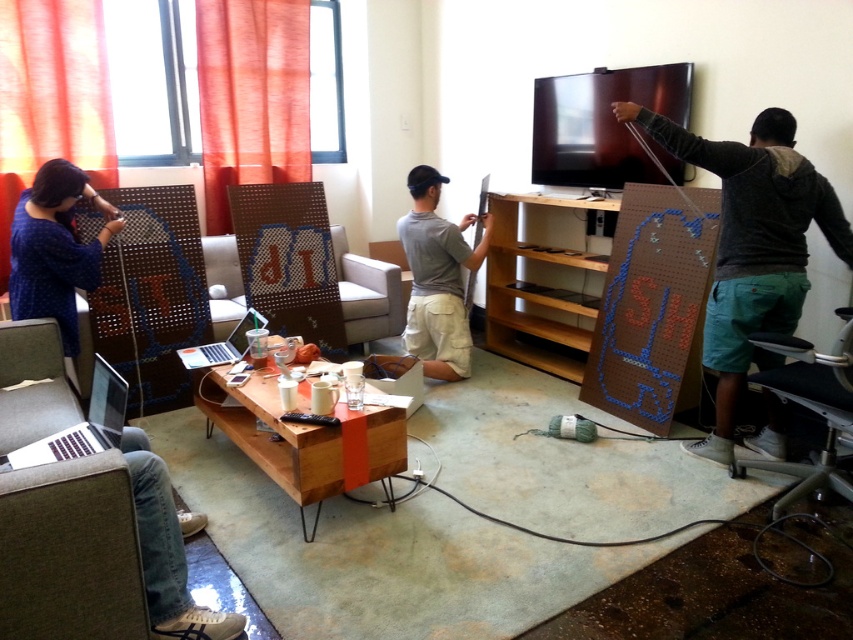
Is point (41, 291) farther from camera compared to point (436, 326)?

That is False.

Find the location of a particular element. The height and width of the screenshot is (640, 853). blue fabric shirt at left is located at coordinates (55, 248).

Is green cotton shorts at right below gray matte shirt at center?

Yes.

Between green cotton shorts at right and gray matte shirt at center, which one appears on the right side from the viewer's perspective?

green cotton shorts at right is more to the right.

Locate an element on the screen. This screenshot has width=853, height=640. green cotton shorts at right is located at coordinates (751, 246).

Which is more to the left, green cotton shorts at right or blue fabric shirt at left?

blue fabric shirt at left

Is point (741, 308) in front of point (68, 214)?

That is True.

Image resolution: width=853 pixels, height=640 pixels. Find the location of `green cotton shorts at right`. green cotton shorts at right is located at coordinates (751, 246).